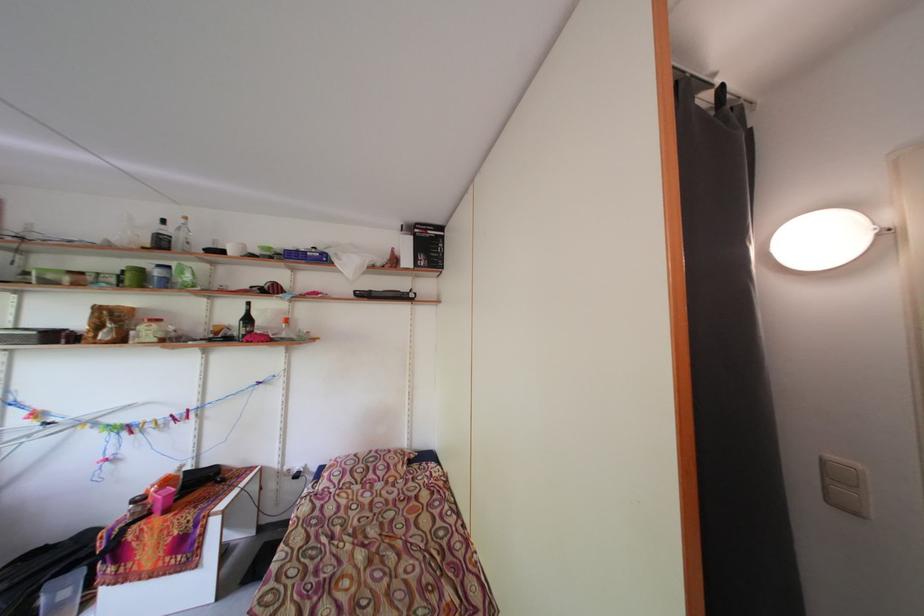
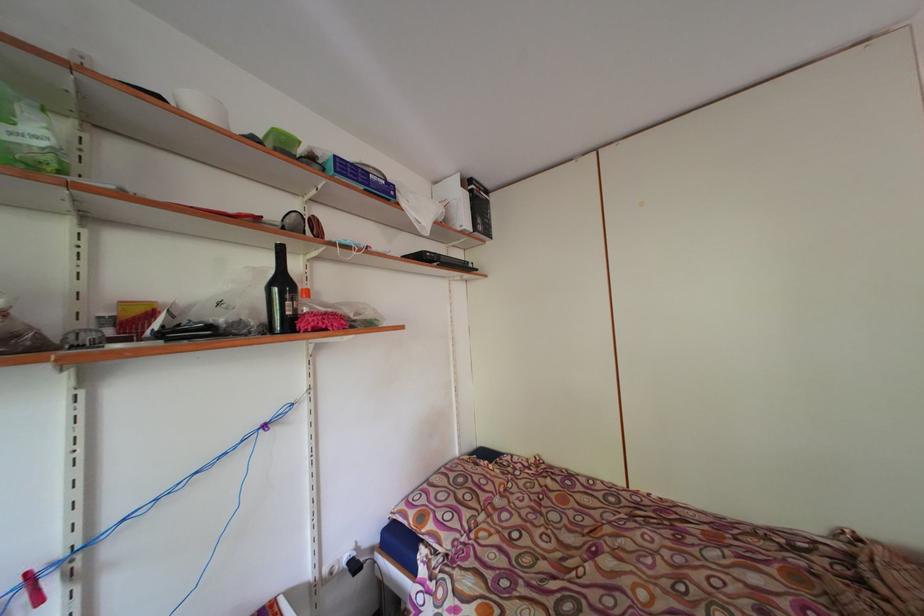
In the second image, find the point that corresponds to (x=256, y=325) in the first image.

(290, 289)